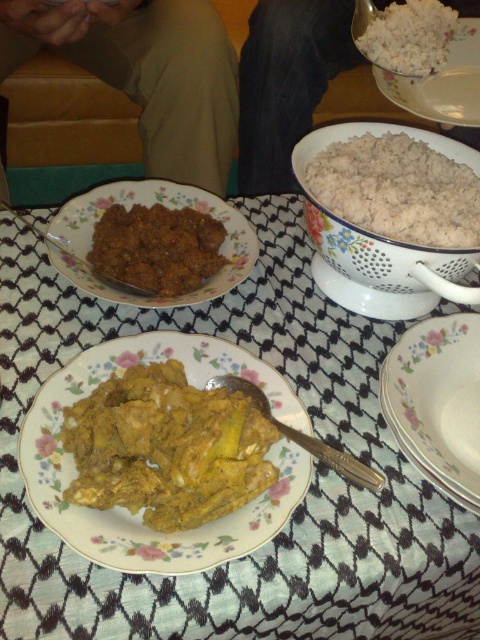
Can you confirm if brown fabric shirt at upper left is shorter than black fabric pants at lower center?

Yes.

Is brown fabric shirt at upper left below black fabric pants at lower center?

Yes.

Which is in front, point (20, 49) or point (242, 179)?

Point (20, 49) is in front.

Image resolution: width=480 pixels, height=640 pixels. I want to click on brown fabric shirt at upper left, so click(x=155, y=80).

Does brown fabric shirt at upper left appear over brown crumbly at center?

Indeed, brown fabric shirt at upper left is positioned over brown crumbly at center.

Does brown fabric shirt at upper left have a larger size compared to brown crumbly at center?

Yes, brown fabric shirt at upper left is bigger than brown crumbly at center.

Is point (117, 81) farther from viewer compared to point (202, 250)?

Yes, point (117, 81) is farther from viewer.

Where is `brown fabric shirt at upper left`? The height and width of the screenshot is (640, 480). brown fabric shirt at upper left is located at coordinates (155, 80).

Which is more to the right, yellow matte curry plate at lower left or white porcelain plate at lower right?

Positioned to the right is white porcelain plate at lower right.

How distant is yellow matte curry plate at lower left from white porcelain plate at lower right?

yellow matte curry plate at lower left is 5.70 inches away from white porcelain plate at lower right.

Between point (13, 360) and point (457, 317), which one is positioned in front?

Point (13, 360)

Identify the location of yellow matte curry plate at lower left. This screenshot has height=640, width=480. (296, 508).